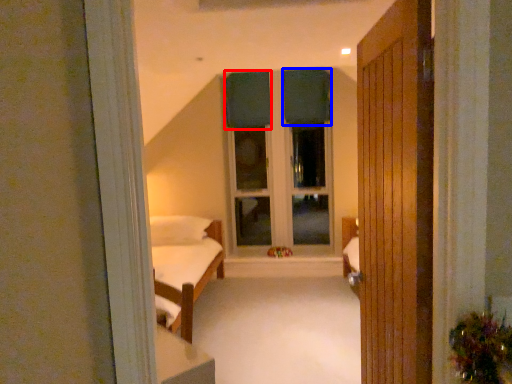
Question: Which object appears closest to the camera in this image, curtain (highlighted by a red box) or curtain (highlighted by a blue box)?

Choices:
 (A) curtain
 (B) curtain

Answer: (B)